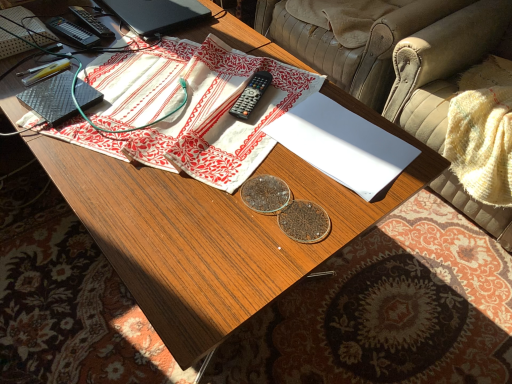
Find the location of a particular element. This screenshot has width=512, height=384. vacant space in between black matte laptop at upper left and white paper at center is located at coordinates (234, 64).